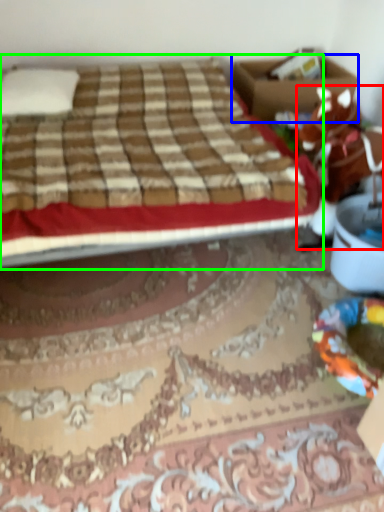
Question: Based on their relative distances, which object is farther from animal (highlighted by a red box)? Choose from box (highlighted by a blue box) and bed (highlighted by a green box).

Choices:
 (A) box
 (B) bed

Answer: (A)